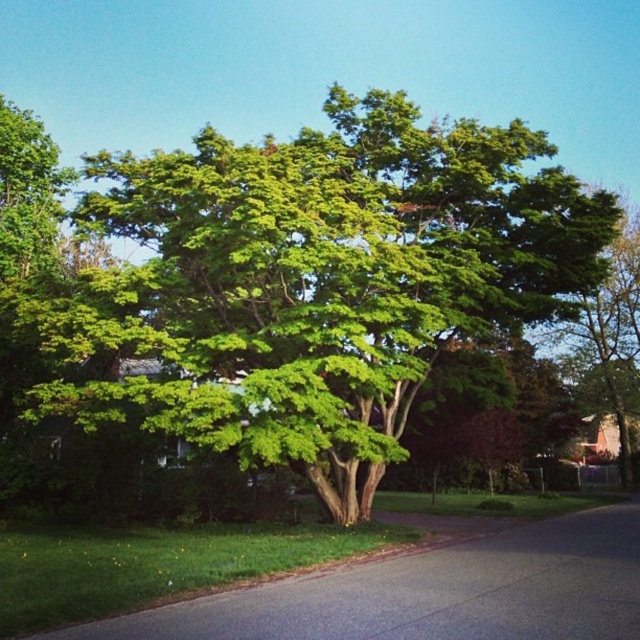
You are a landscape architect designing a garden and need to plant a new tree. You have two options from the image, the green leafy tree at center and the green leafy tree at right. Which tree should you choose if you want a taller tree for shade?

The green leafy tree at right is taller than the green leafy tree at center, so you should choose the green leafy tree at right for a taller tree for shade.

You are standing in a park and want to take a photo of the green leafy tree at center. If your camera can focus on objects up to 10 meters away, will you be able to capture the tree clearly?

The green leafy tree at center is 12.13 meters away from the viewer. Since the camera can only focus up to 10 meters, you won first be able to capture the tree clearly.

You are standing in front of the large tree with lush green foliage. You notice two points marked on the image. The first point is at coordinate point (x=256, y=392), and the second point is at coordinate point (x=628, y=257). Which point is closer to you?

Point (x=256, y=392) is closer to you than point (x=628, y=257).